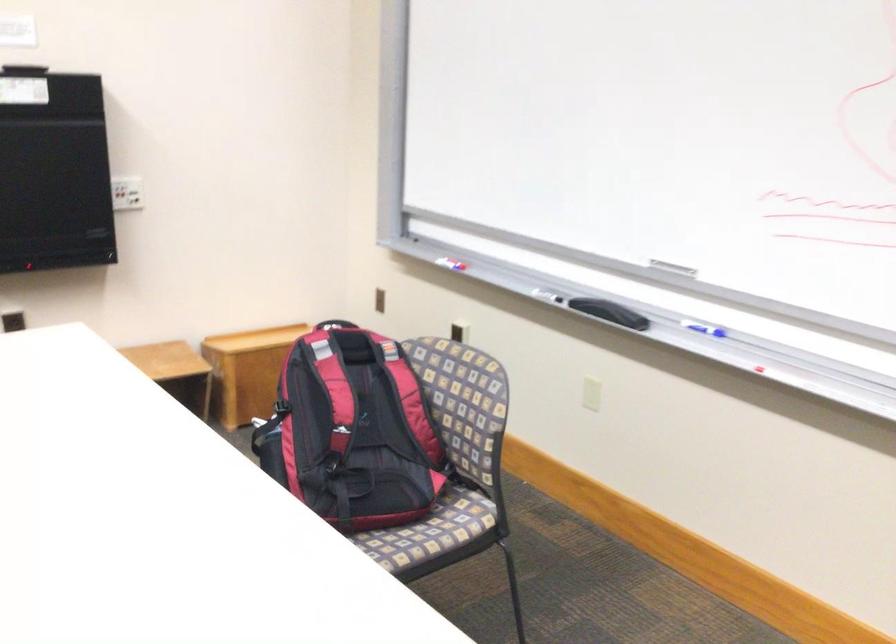
Find where to pull the black backpack handle. Please return your answer as a coordinate pair (x, y).

(334, 391)